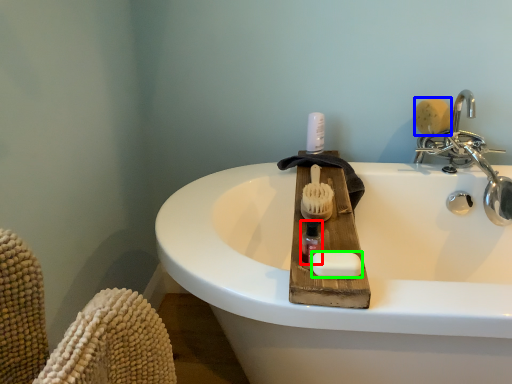
Question: Estimate the real-world distances between objects in this image. Which object is farther from mouthwash (highlighted by a red box), brush (highlighted by a blue box) or soap (highlighted by a green box)?

Choices:
 (A) brush
 (B) soap

Answer: (A)